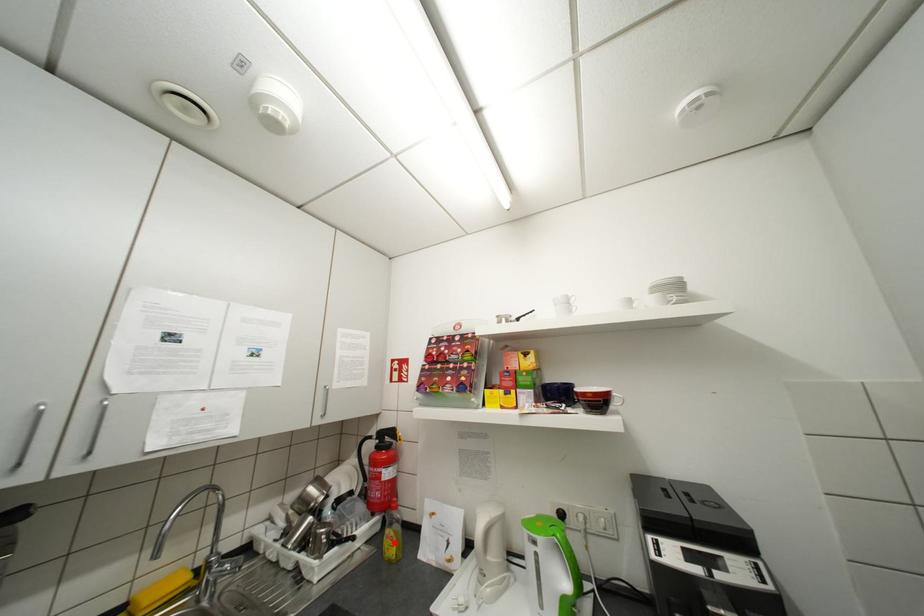
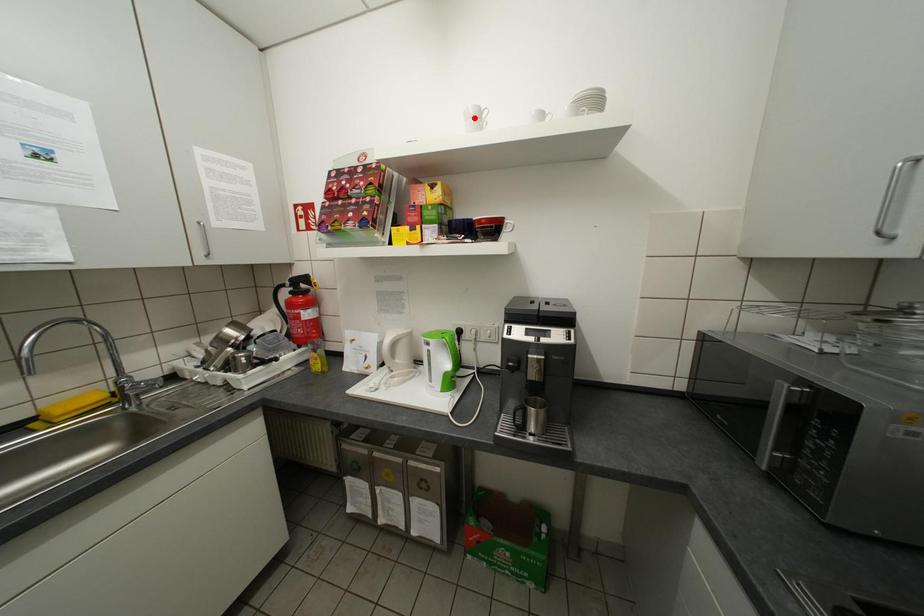
I am providing you with two images of the same scene from different viewpoints. A red point is marked on the first image and another point is marked on the second image. Is the marked point in image1 the same physical position as the marked point in image2?

No